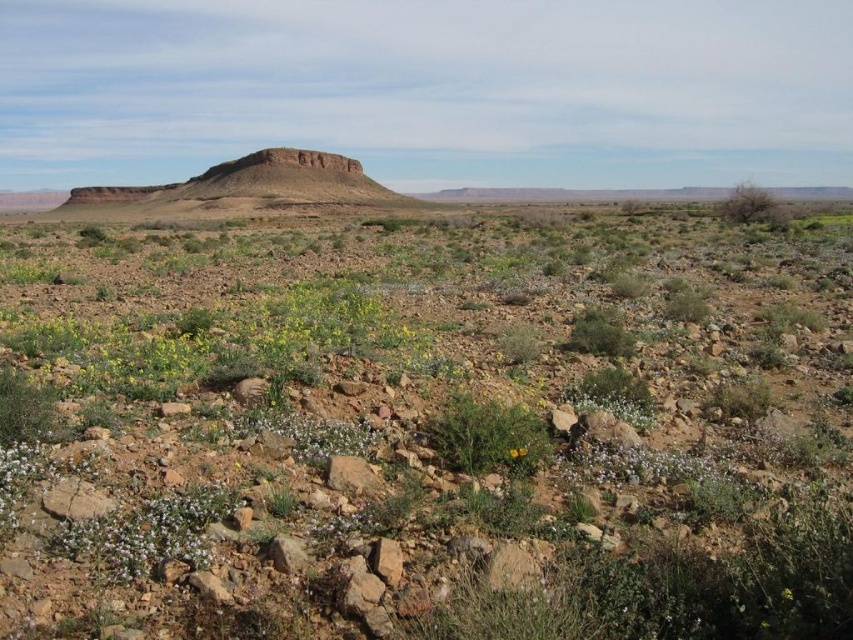
Question: Can you confirm if rustic rock formation at center is bigger than green leafy plant at center?

Choices:
 (A) yes
 (B) no

Answer: (A)

Question: Which object is closer to the camera taking this photo?

Choices:
 (A) rustic rock formation at center
 (B) green leafy plant at center
 (C) brown rocky hill at upper center

Answer: (C)

Question: Which point is closer to the camera?

Choices:
 (A) rustic rock formation at center
 (B) green leafy plant at center

Answer: (B)

Question: Observing the image, what is the correct spatial positioning of brown rocky hill at upper center in reference to green leafy plant at center?

Choices:
 (A) left
 (B) right

Answer: (A)

Question: Is brown rocky hill at upper center bigger than rustic rock formation at center?

Choices:
 (A) no
 (B) yes

Answer: (A)

Question: Among these points, which one is farthest from the camera?

Choices:
 (A) (523, 438)
 (B) (70, 608)
 (C) (331, 172)

Answer: (C)